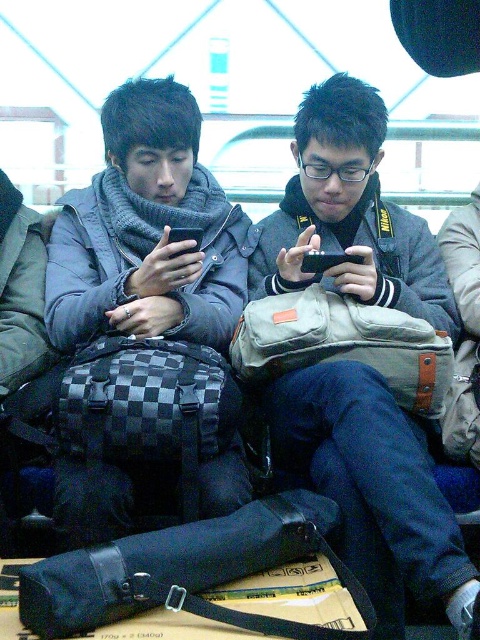
Question: Which point is closer to the camera?

Choices:
 (A) checkered fabric backpack at left
 (B) black matte smartphone at center

Answer: (A)

Question: Based on their relative distances, which object is nearer to the canvas messenger bag at center?

Choices:
 (A) matte gray jacket at center
 (B) black matte smartphone at center
 (C) black canvas camera bag at lower center

Answer: (A)

Question: Estimate the real-world distances between objects in this image. Which object is farther from the matte gray scarf at center?

Choices:
 (A) matte gray jacket at center
 (B) black matte smartphone at center
 (C) canvas messenger bag at center
 (D) black canvas camera bag at lower center

Answer: (D)

Question: Does matte gray jacket at center have a larger size compared to checkered fabric backpack at left?

Choices:
 (A) no
 (B) yes

Answer: (B)

Question: From the image, what is the correct spatial relationship of matte gray scarf at center in relation to black canvas camera bag at lower center?

Choices:
 (A) right
 (B) left

Answer: (B)

Question: Can you confirm if black canvas camera bag at lower center is positioned to the right of black matte smartphone at center?

Choices:
 (A) yes
 (B) no

Answer: (B)